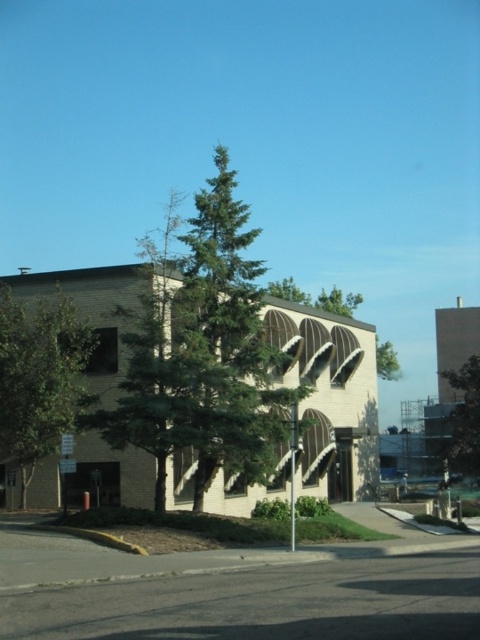
Question: Is green leafy tree at left thinner than green leafy tree at center?

Choices:
 (A) yes
 (B) no

Answer: (A)

Question: Does green leafy tree at left appear over green leafy tree at center?

Choices:
 (A) yes
 (B) no

Answer: (A)

Question: Does green leafy tree at left appear on the left side of green leafy tree at center?

Choices:
 (A) yes
 (B) no

Answer: (A)

Question: Which point is farther to the camera?

Choices:
 (A) (8, 406)
 (B) (467, 467)

Answer: (B)